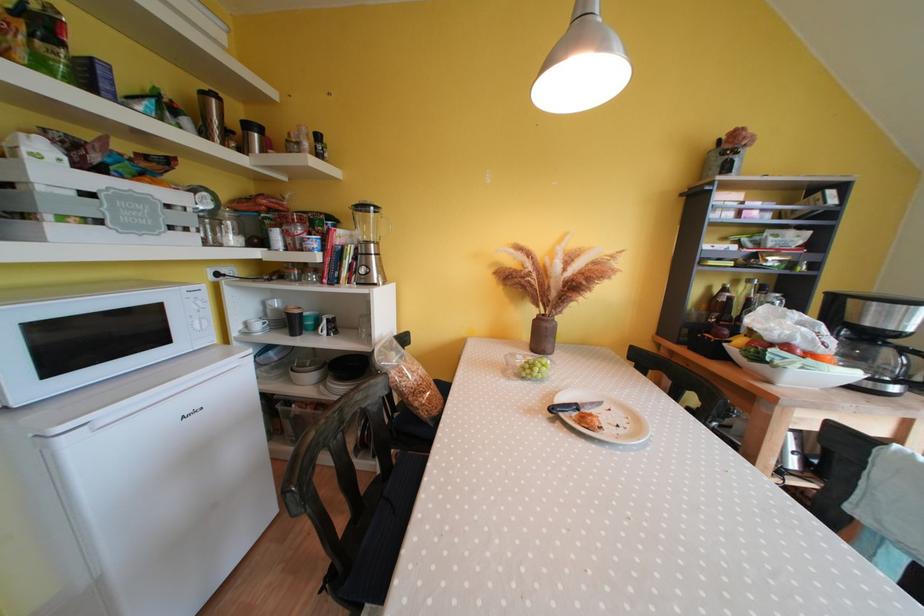
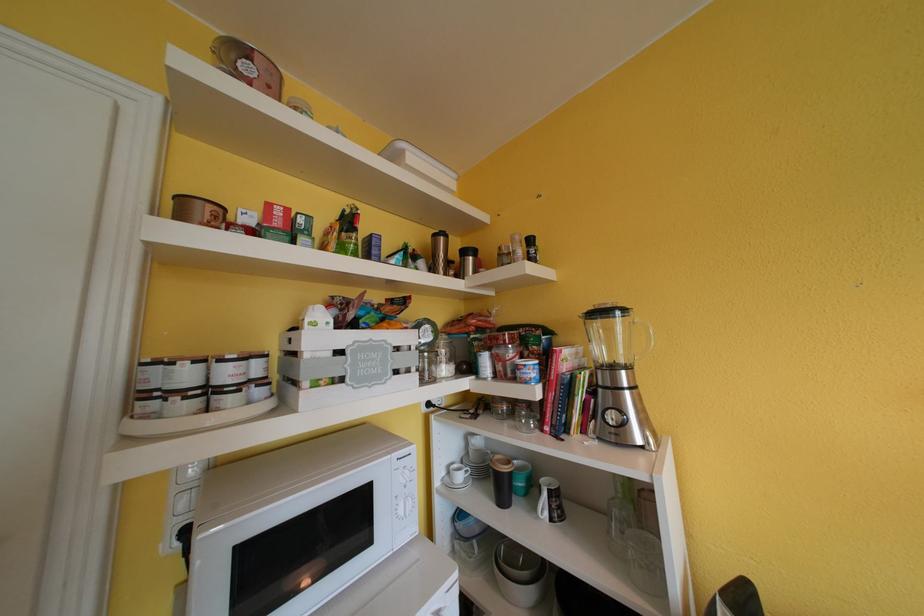
Based on the continuous images, in which direction is the camera rotating?

The rotation direction of the camera is left-up.